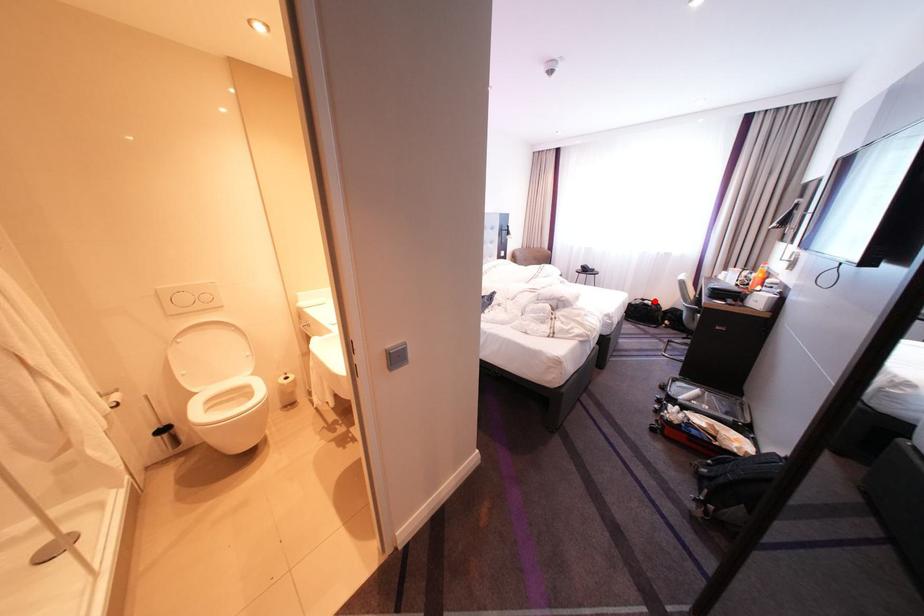
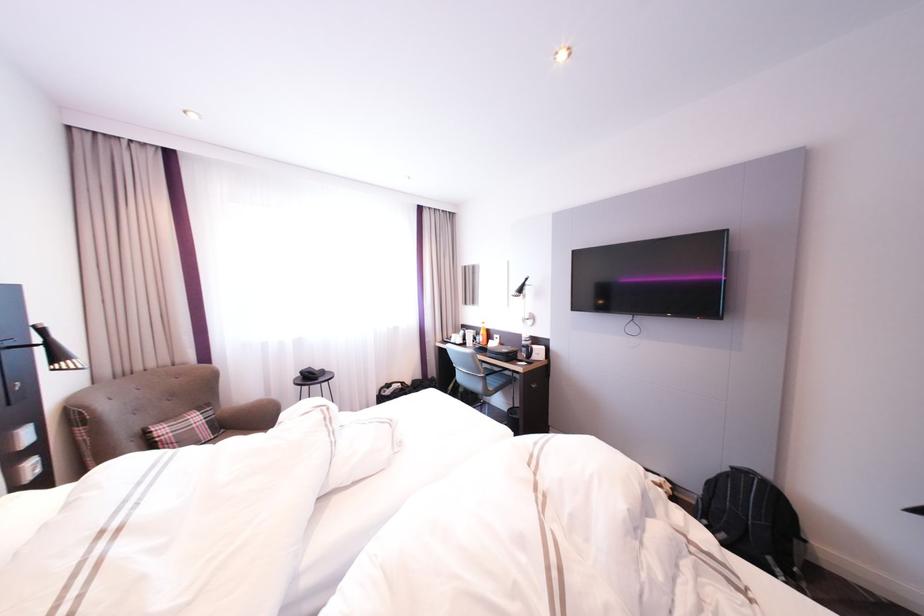
Question: I am providing you with two images of the same scene from different viewpoints. Given a red point in image1, look at the same physical point in image2. Is it:

Choices:
 (A) Closer to the viewpoint
 (B) Farther from the viewpoint

Answer: (A)